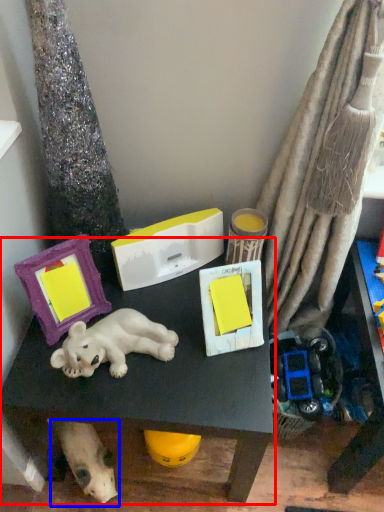
Question: Which point is closer to the camera, table (highlighted by a red box) or dog (highlighted by a blue box)?

Choices:
 (A) table
 (B) dog

Answer: (A)